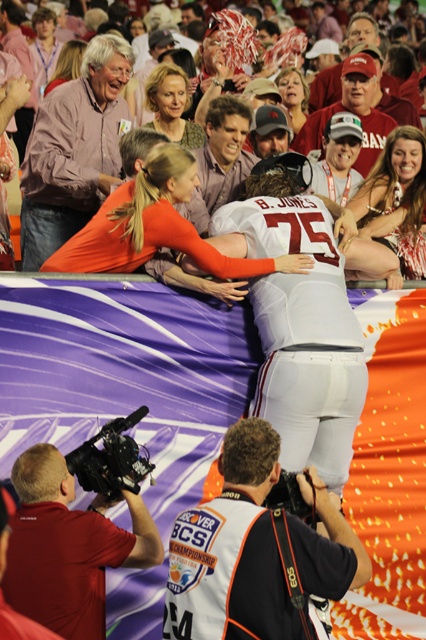
Question: Which object is closer to the camera taking this photo?

Choices:
 (A) matte orange jersey at center
 (B) white fabric jersey at upper center

Answer: (B)

Question: Is white fabric jersey at upper center in front of matte orange jersey at center?

Choices:
 (A) yes
 (B) no

Answer: (A)

Question: Which point is farther from the camera taking this photo?

Choices:
 (A) (221, 550)
 (B) (46, 525)
 (C) (371, 266)

Answer: (C)

Question: Where is white fabric jersey at upper center located in relation to matte orange jersey at center in the image?

Choices:
 (A) below
 (B) above

Answer: (A)

Question: Based on their relative distances, which object is farther from the matte orange jersey at center?

Choices:
 (A) matte black camera at lower left
 (B) white fabric jersey at upper center

Answer: (A)

Question: Does matte black camera at lower left appear over matte orange jersey at center?

Choices:
 (A) yes
 (B) no

Answer: (B)